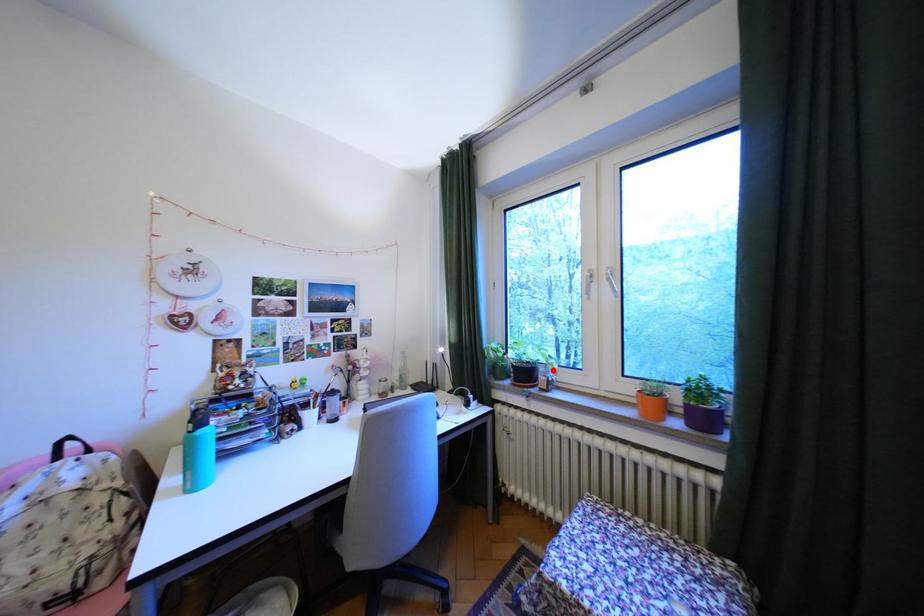
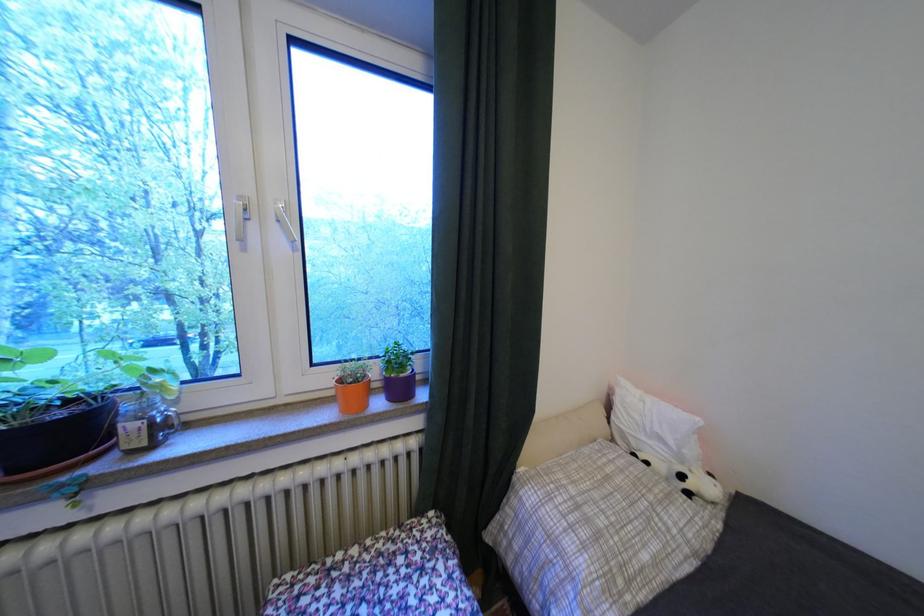
Question: I am providing you with two images of the same scene from different viewpoints. Given a red point in image1, look at the same physical point in image2. Is it:

Choices:
 (A) Closer to the viewpoint
 (B) Farther from the viewpoint

Answer: (A)